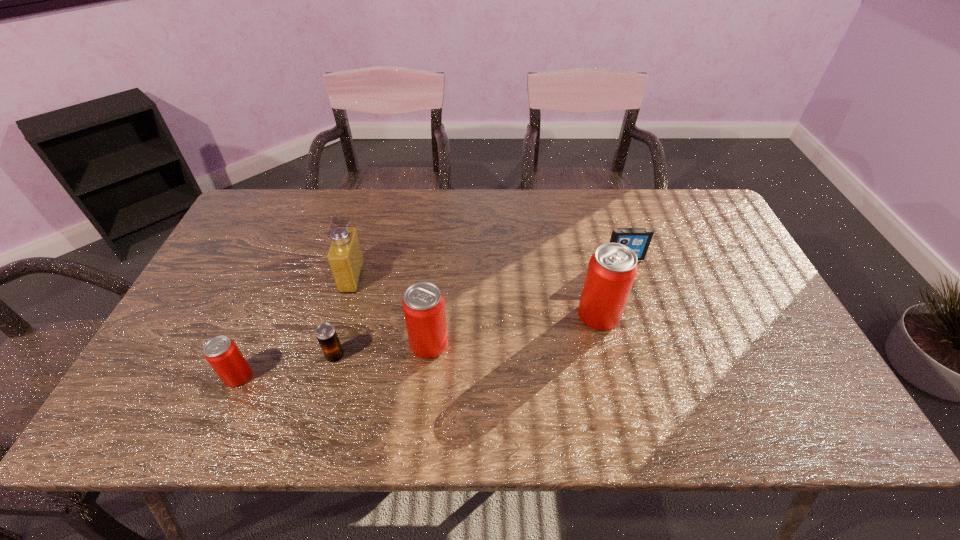
Please point a spot to add another can on the right. Please provide its 2D coordinates. Your answer should be formatted as a tuple, i.e. [(x, y)], where the tuple contains the x and y coordinates of a point satisfying the conditions above.

[(751, 289)]